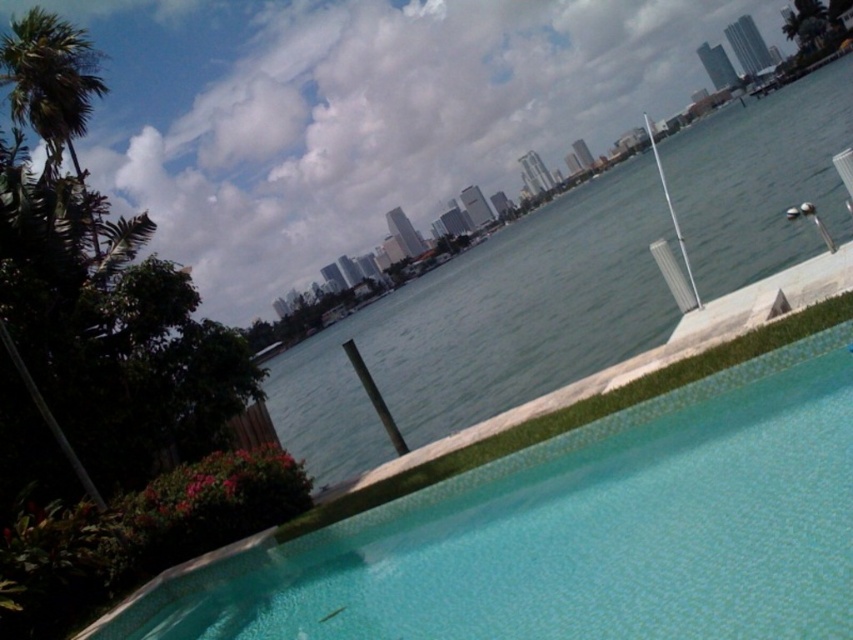
Consider the image. Who is more forward, (363, 524) or (534, 237)?

Point (363, 524) is more forward.

Can you confirm if clear glass pool at lower right is smaller than clear water at center?

Yes.

Image resolution: width=853 pixels, height=640 pixels. I want to click on clear glass pool at lower right, so click(555, 518).

Locate an element on the screen. clear glass pool at lower right is located at coordinates (555, 518).